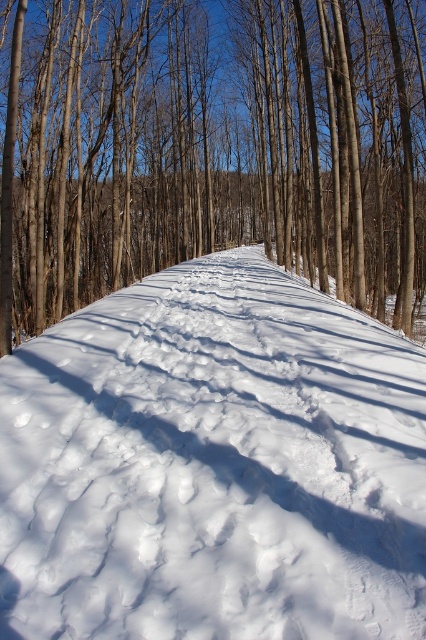
You are standing at the starting point of the path in the winter forest scene. You notice two points marked in the image. Which point, point (14, 365) or point (374, 202), is closer to you?

Point (14, 365) is closer to the viewer than point (374, 202).

In the scene shown: You are an explorer in the winter forest and see the white fluffy snow at center and the brown smooth tree at center. Which object appears larger in the image?

The brown smooth tree at center appears larger than the white fluffy snow at center.

You are an explorer trying to navigate through the winter forest. You see the white fluffy snow at center and the brown smooth tree at center. Which one is taller?

The white fluffy snow at center is not as tall as the brown smooth tree at center, so the brown smooth tree at center is taller.